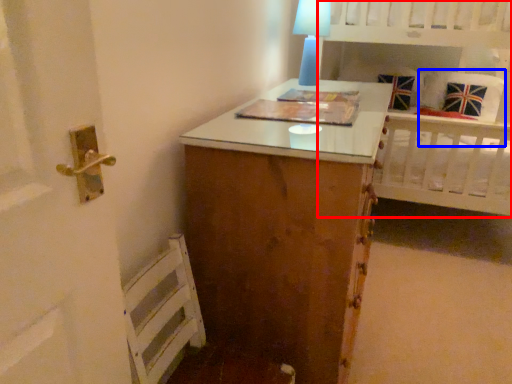
Question: Which object is closer to the camera taking this photo, bed (highlighted by a red box) or pillow (highlighted by a blue box)?

Choices:
 (A) bed
 (B) pillow

Answer: (A)